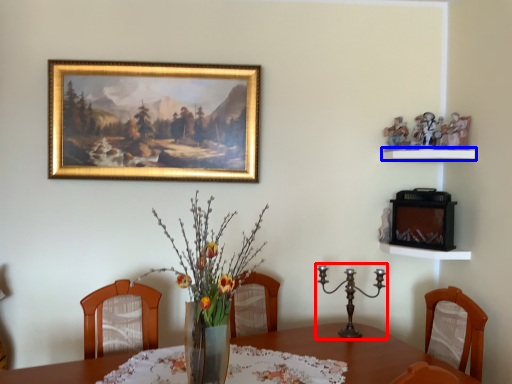
Question: Among these objects, which one is farthest to the camera, candle holder (highlighted by a red box) or shelf (highlighted by a blue box)?

Choices:
 (A) candle holder
 (B) shelf

Answer: (B)